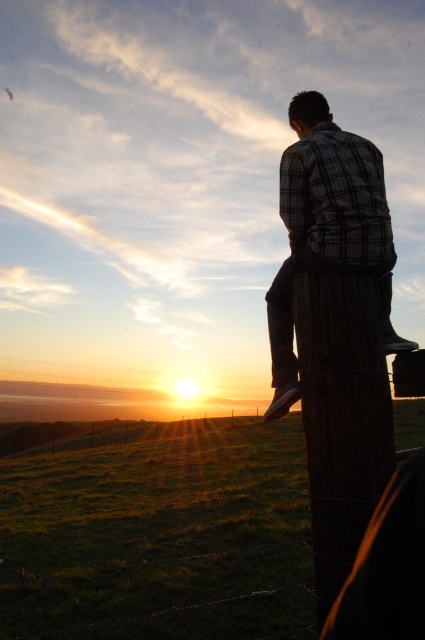
Which is more to the right, dark brown wooden post at right or plaid fabric shirt at center?

Positioned to the right is dark brown wooden post at right.

Based on the photo, is dark brown wooden post at right thinner than plaid fabric shirt at center?

No, dark brown wooden post at right is not thinner than plaid fabric shirt at center.

At what (x,y) coordinates should I click in order to perform the action: click on dark brown wooden post at right. Please return your answer as a coordinate pair (x, y). The height and width of the screenshot is (640, 425). Looking at the image, I should click on (342, 413).